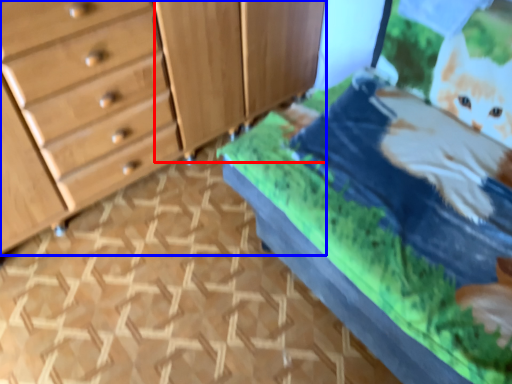
Question: Among these objects, which one is farthest to the camera, cabinetry (highlighted by a red box) or chest of drawers (highlighted by a blue box)?

Choices:
 (A) cabinetry
 (B) chest of drawers

Answer: (A)